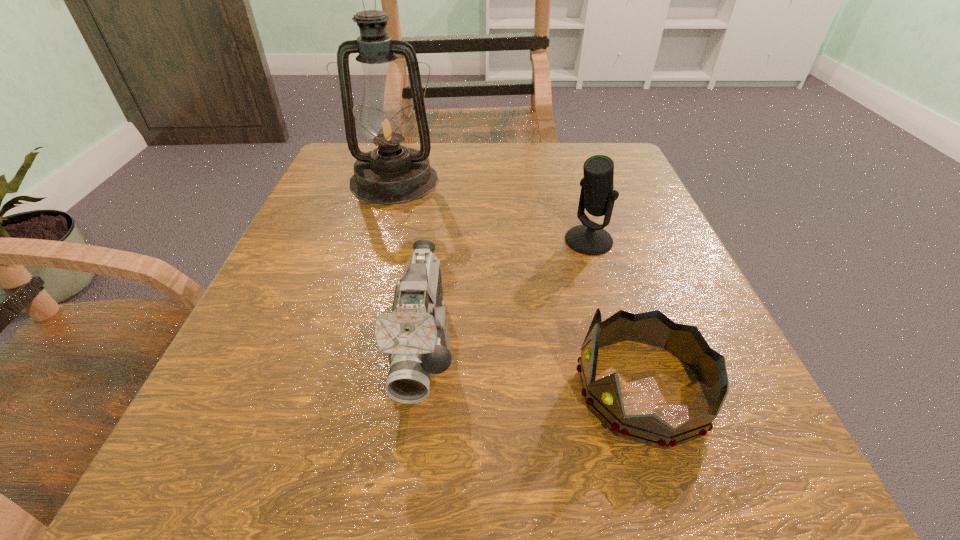
The width and height of the screenshot is (960, 540). Find the location of `object that is the third closest to the oil lamp`. object that is the third closest to the oil lamp is located at coordinates (604, 397).

In order to click on object that ranks as the third closest to the tiara in this screenshot , I will do `click(390, 174)`.

Locate an element on the screen. vacant area that satisfies the following two spatial constraints: 1. on the front side of the second farthest object; 2. on the right side of the farthest object is located at coordinates (377, 240).